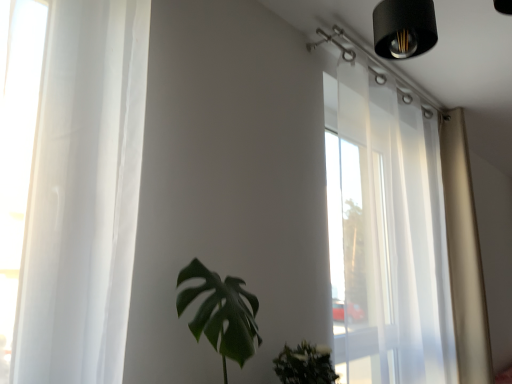
Question: Relative to green matte leafy plant at center, is beige fabric curtain at right in front or behind?

Choices:
 (A) behind
 (B) front

Answer: (A)

Question: From the image's perspective, is beige fabric curtain at right above or below green matte leafy plant at center?

Choices:
 (A) below
 (B) above

Answer: (B)

Question: Which of these objects is positioned closest to the beige fabric curtain at right?

Choices:
 (A) transparent curtain at upper right
 (B) green matte leafy plant at center

Answer: (A)

Question: Estimate the real-world distances between objects in this image. Which object is closer to the beige fabric curtain at right?

Choices:
 (A) transparent curtain at upper right
 (B) green matte leafy plant at center

Answer: (A)